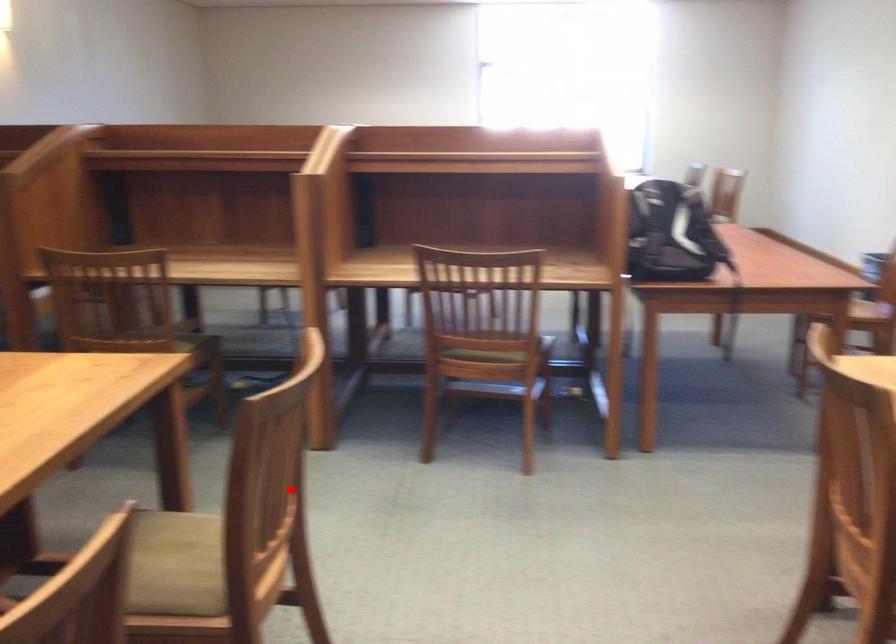
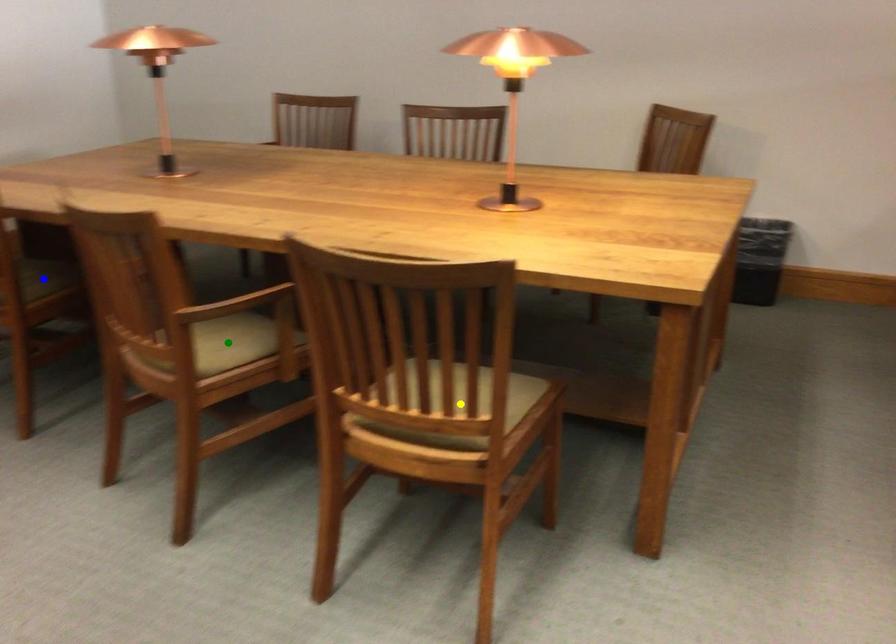
Question: I am providing you with two images of the same scene from different viewpoints. A red point is marked on the first image. You are given multiple points on the second image. Which spot in image 2 lines up with the point in image 1?

Choices:
 (A) green point
 (B) blue point
 (C) yellow point

Answer: (C)